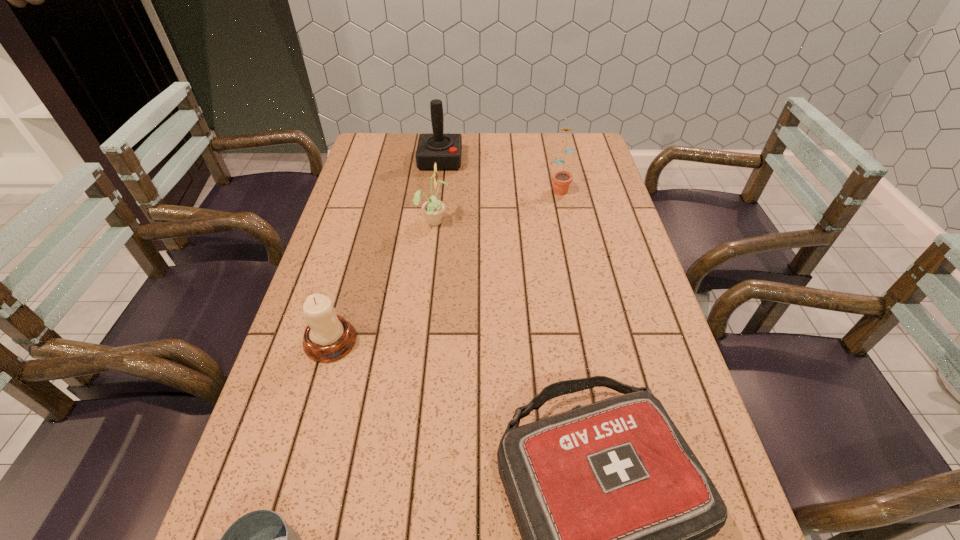
Locate an element on the screen. The image size is (960, 540). vacant area located on the right of the candle holder is located at coordinates (419, 341).

Locate an element on the screen. This screenshot has width=960, height=540. object positioned at the far edge is located at coordinates (445, 150).

Find the location of a particular element. object at the left edge is located at coordinates (328, 337).

Image resolution: width=960 pixels, height=540 pixels. I want to click on object that is positioned at the right edge, so click(561, 180).

The image size is (960, 540). What are the coordinates of `vacant region at the left edge of the desktop` in the screenshot? It's located at (325, 433).

The width and height of the screenshot is (960, 540). I want to click on blank space at the right edge of the desktop, so click(640, 289).

Where is `vacant region at the far left corner`? This screenshot has height=540, width=960. vacant region at the far left corner is located at coordinates (379, 134).

This screenshot has height=540, width=960. What are the coordinates of `vacant space that is in between the farther sunflower and the farthest object` in the screenshot? It's located at [500, 174].

Image resolution: width=960 pixels, height=540 pixels. I want to click on free space between the farthest object and the fourth farthest object, so click(x=385, y=251).

The image size is (960, 540). In order to click on free space between the right sunflower and the joystick in this screenshot , I will do `click(500, 174)`.